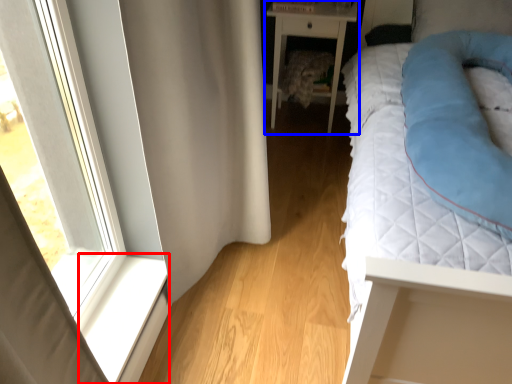
Question: Which point is closer to the camera, window sill (highlighted by a red box) or nightstand (highlighted by a blue box)?

Choices:
 (A) window sill
 (B) nightstand

Answer: (A)